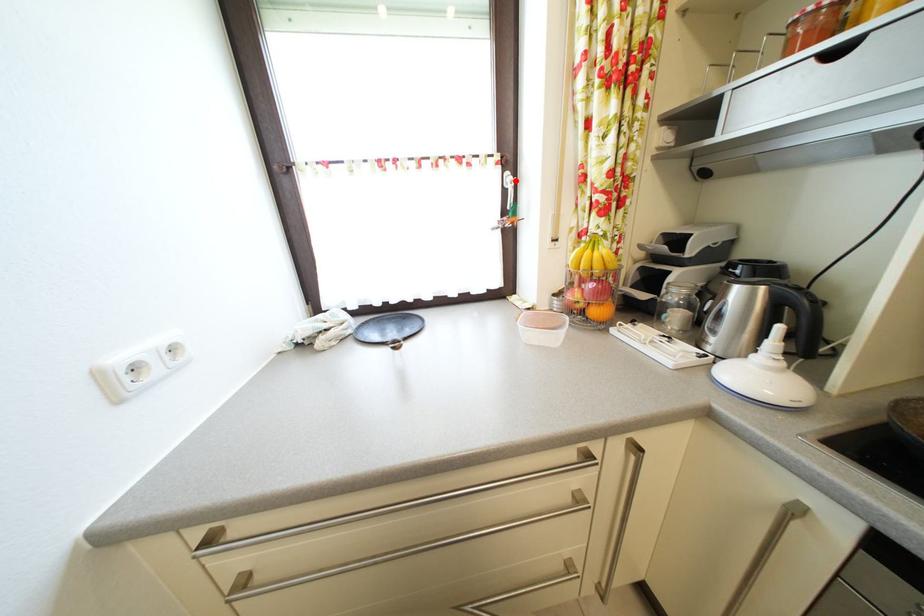
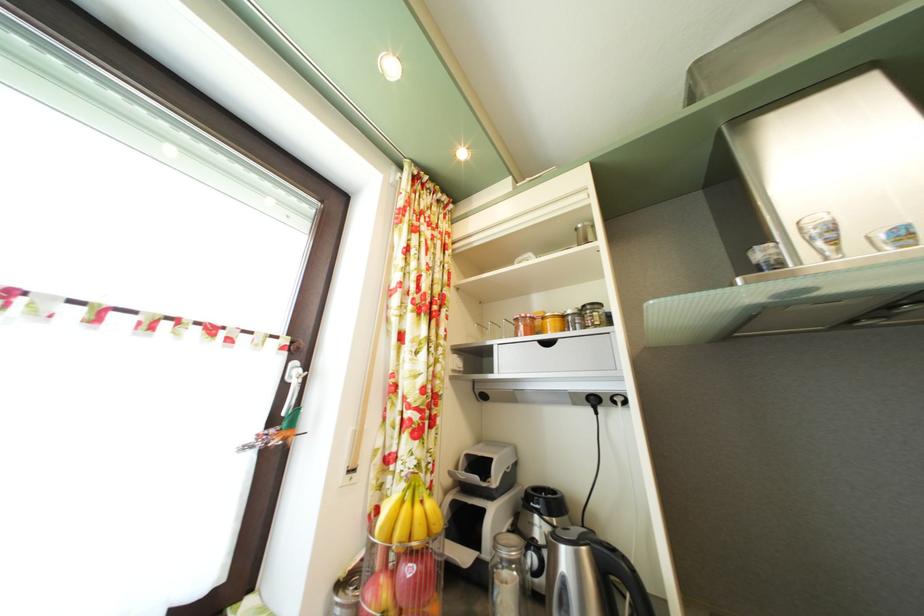
In the second image, find the point that corresponds to the highlighted location in the first image.

(304, 371)